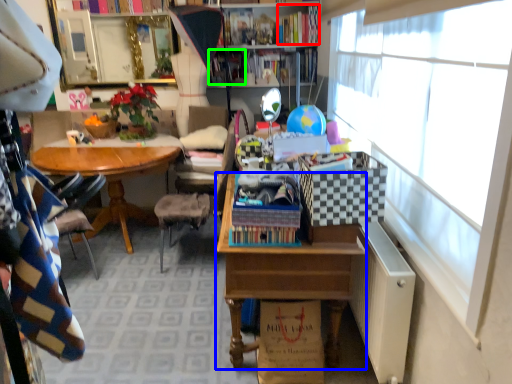
Question: Based on their relative distances, which object is nearer to book (highlighted by a red box)? Choose from desk (highlighted by a blue box) and book (highlighted by a green box).

Choices:
 (A) desk
 (B) book

Answer: (B)